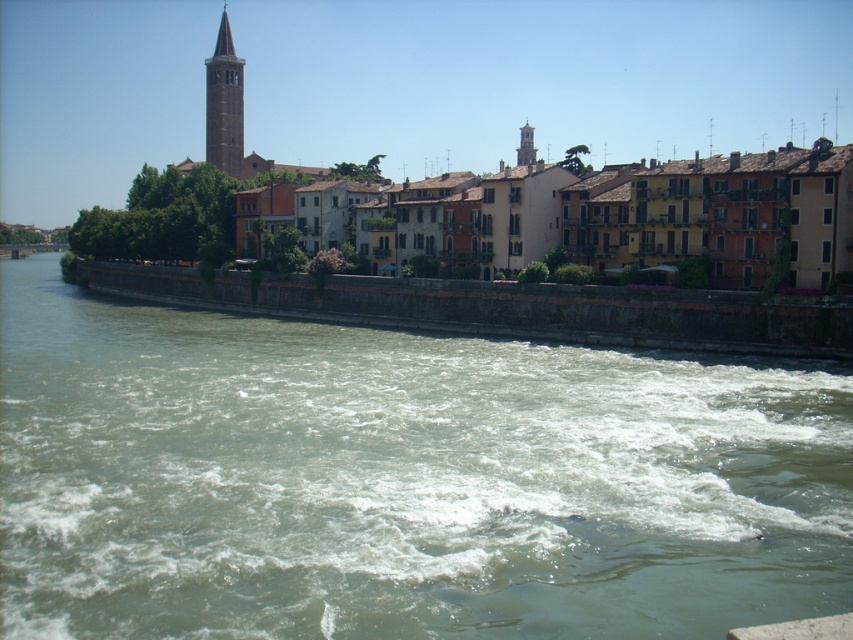
Question: Can you confirm if greenish concrete river at center is positioned below multicolored stone buildings at center?

Choices:
 (A) no
 (B) yes

Answer: (B)

Question: Does greenish concrete river at center appear under smooth beige bell tower at upper left?

Choices:
 (A) yes
 (B) no

Answer: (A)

Question: Which object is farther from the camera taking this photo?

Choices:
 (A) multicolored stone buildings at center
 (B) smooth beige bell tower at upper left
 (C) greenish concrete river at center

Answer: (B)

Question: Which object is positioned closest to the multicolored stone buildings at center?

Choices:
 (A) greenish concrete river at center
 (B) smooth beige bell tower at upper left

Answer: (A)

Question: Does greenish concrete river at center have a larger size compared to smooth beige bell tower at upper left?

Choices:
 (A) no
 (B) yes

Answer: (A)

Question: Which point is farther to the camera?

Choices:
 (A) greenish concrete river at center
 (B) smooth beige bell tower at upper left
 (C) multicolored stone buildings at center

Answer: (B)